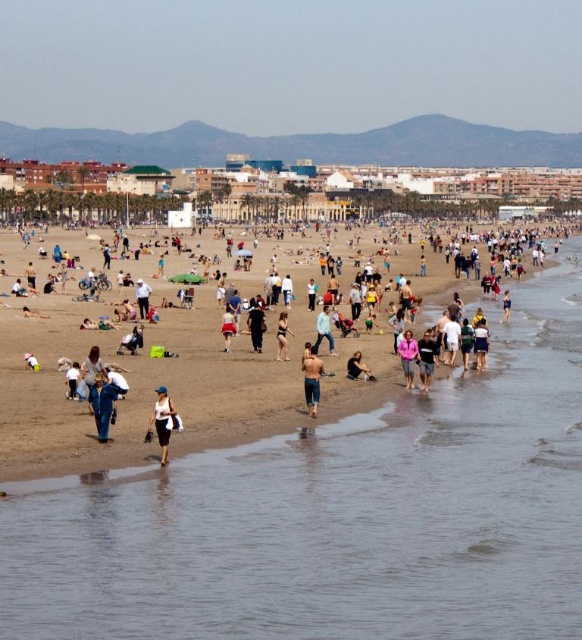
Question: Which object appears closest to the camera in this image?

Choices:
 (A) blue denim jeans at lower left
 (B) denim shorts at center
 (C) clear water at beach center

Answer: (C)

Question: Which point is closer to the camera?

Choices:
 (A) blue denim jeans at lower left
 (B) pink fabric jacket at lower center
 (C) pink fabric at lower center

Answer: (A)

Question: Which of these objects is positioned closest to the blue denim jeans at lower left?

Choices:
 (A) black matte pants at center
 (B) blue denim jeans at center
 (C) pink fabric at lower center
 (D) white cotton shorts at center

Answer: (C)

Question: Can you confirm if pink fabric at lower center is smaller than white cotton shorts at center?

Choices:
 (A) yes
 (B) no

Answer: (A)

Question: Is white matte dress at lower center bigger than denim shorts at center?

Choices:
 (A) yes
 (B) no

Answer: (B)

Question: Does dark brown leather jacket at lower center have a larger size compared to white cotton shorts at center?

Choices:
 (A) yes
 (B) no

Answer: (B)